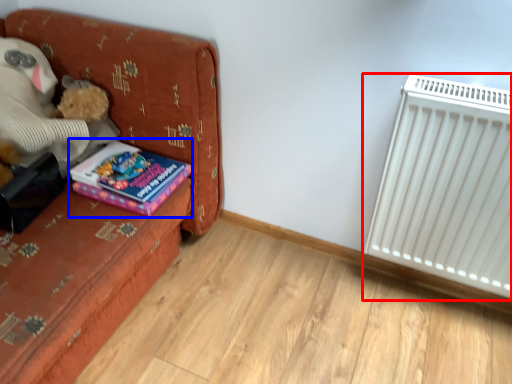
Question: Which point is closer to the camera, radiator (highlighted by a red box) or book (highlighted by a blue box)?

Choices:
 (A) radiator
 (B) book

Answer: (A)